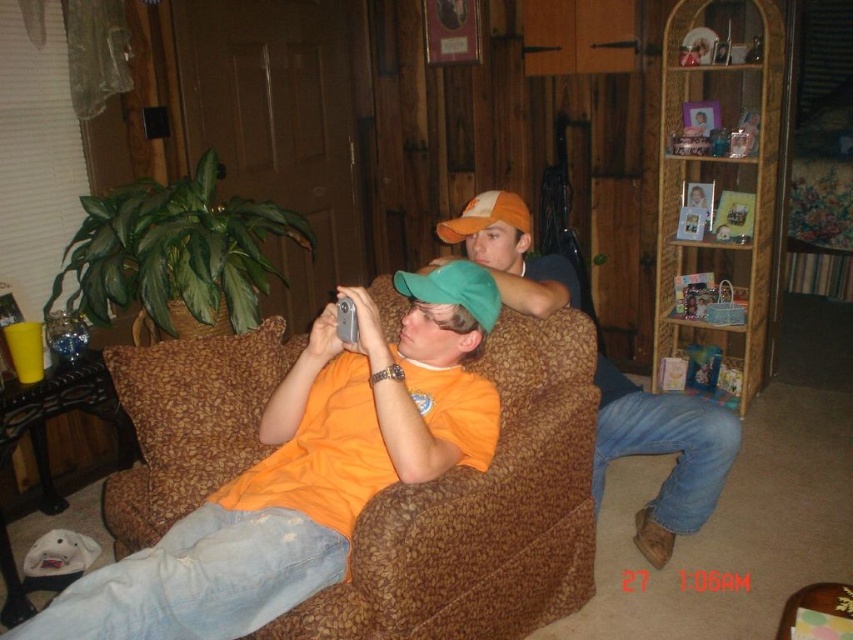
You are a delivery robot with a height of 1.5 meters. You are approaching the brown textured armchair at center in the living room. Can you safely pass under it without hitting your head?

The distance between the brown textured armchair at center and the camera is 1.41 meters, which is less than the robot height of 1.5 meters. Therefore, the robot cannot safely pass under the brown textured armchair at center without hitting its head.

You are standing in the living room and want to place a small plant on the brown textured armchair at center so that it is directly above the orange cotton shirt at center. Is this possible?

The brown textured armchair at center is located below orange cotton shirt at center, so placing a small plant directly above the orange cotton shirt at center would not place it on the armchair. The plant would need to be placed on the armchair below the shirt to align vertically.

You are planning to place a new painting on the wall behind the brown textured armchair at center and the wooden bookshelf at upper right. Based on their positions, which object should the painting be placed behind?

The wooden bookshelf at upper right should be placed behind the brown textured armchair at center because the brown textured armchair at center is in front of the wooden bookshelf at upper right.